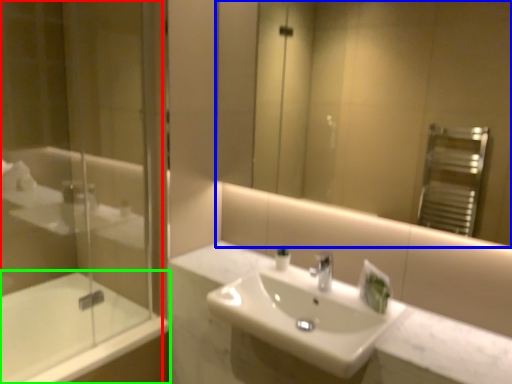
Question: Which is nearer to the shower door (highlighted by a red box)? mirror (highlighted by a blue box) or bathtub (highlighted by a green box).

Choices:
 (A) mirror
 (B) bathtub

Answer: (B)